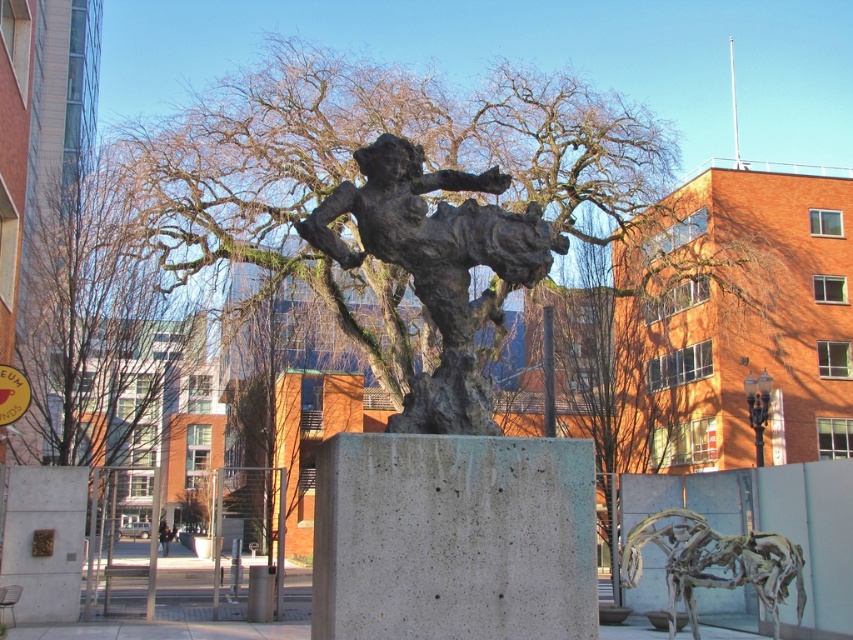
Is bare branches at center taller than bronze textured figure at center?

In fact, bare branches at center may be shorter than bronze textured figure at center.

Does bare branches at center lie in front of bronze textured figure at center?

No, bare branches at center is behind bronze textured figure at center.

Which is behind, point (94, 348) or point (456, 362)?

The point (94, 348) is more distant.

Where is `bare branches at center`? This screenshot has height=640, width=853. bare branches at center is located at coordinates (97, 330).

From the picture: Does bare branches at center have a greater width compared to rustic bronze horse at lower right?

No.

Which is behind, point (137, 435) or point (798, 552)?

The point (137, 435) is more distant.

Is point (77, 428) positioned after point (676, 515)?

Yes, it is.

Find the location of a particular element. The image size is (853, 640). bare branches at center is located at coordinates (97, 330).

Measure the distance between bare branches at center and dark clothing at lower center.

bare branches at center is 9.28 meters from dark clothing at lower center.

Measure the distance from bare branches at center to dark clothing at lower center.

bare branches at center is 30.44 feet away from dark clothing at lower center.

In order to click on bare branches at center in this screenshot , I will do `click(97, 330)`.